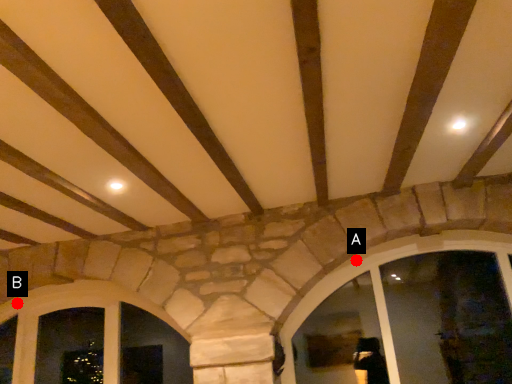
Question: Two points are circled on the image, labeled by A and B beside each circle. Which point is further to the camera?

Choices:
 (A) A is further
 (B) B is further

Answer: (B)